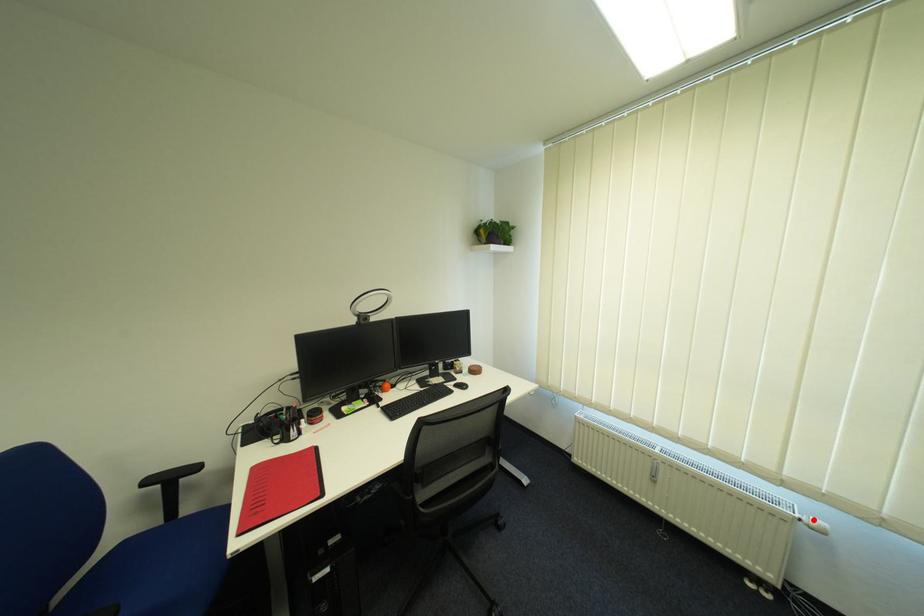
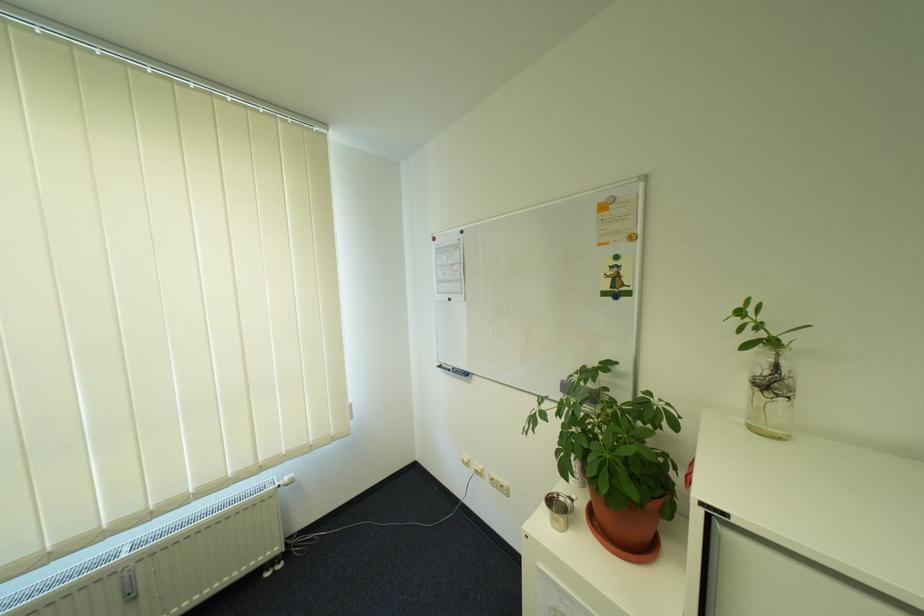
Find the pixel in the second image that matches the highlighted location in the first image.

(290, 484)